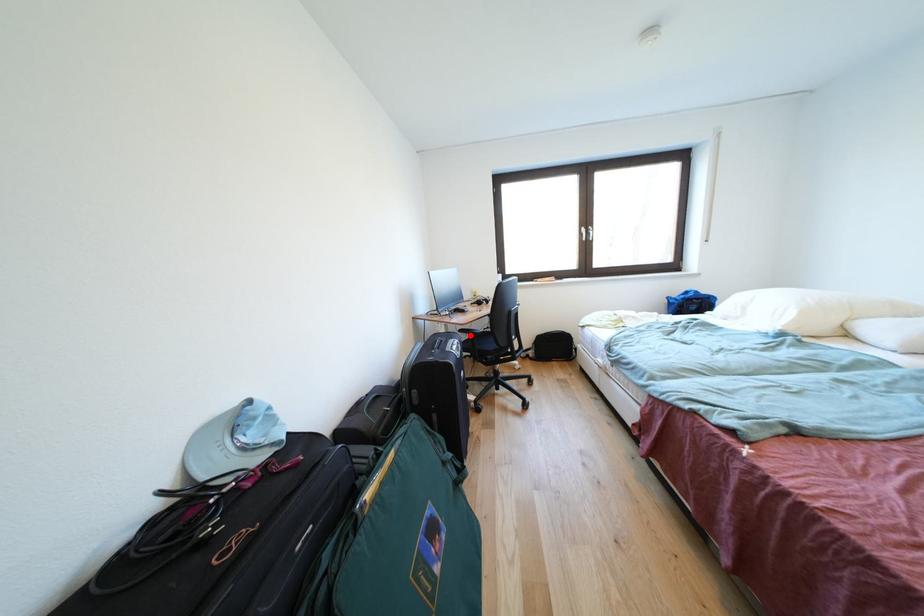
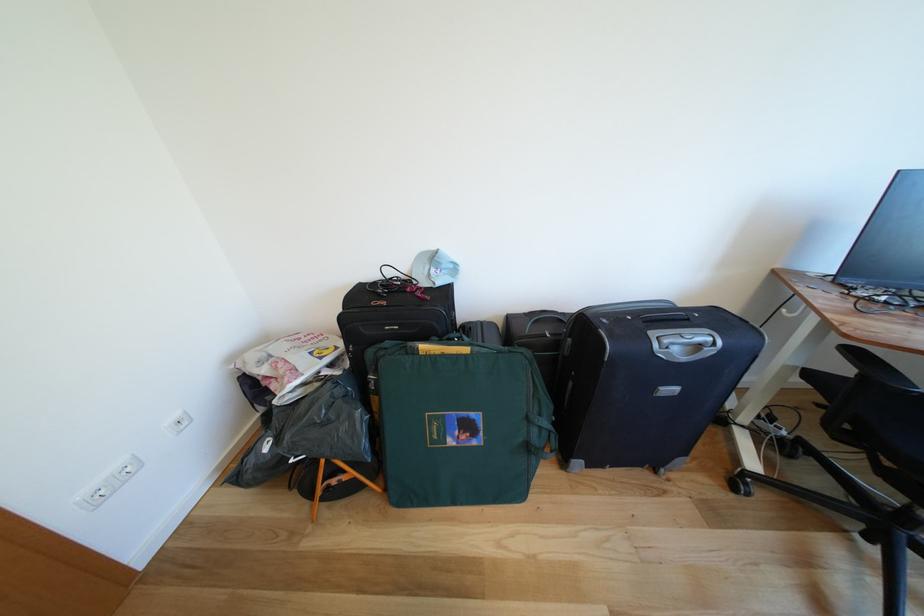
Question: I am providing you with two images of the same scene from different viewpoints. Given a red point in image1, look at the same physical point in image2. Is it:

Choices:
 (A) Closer to the viewpoint
 (B) Farther from the viewpoint

Answer: (B)